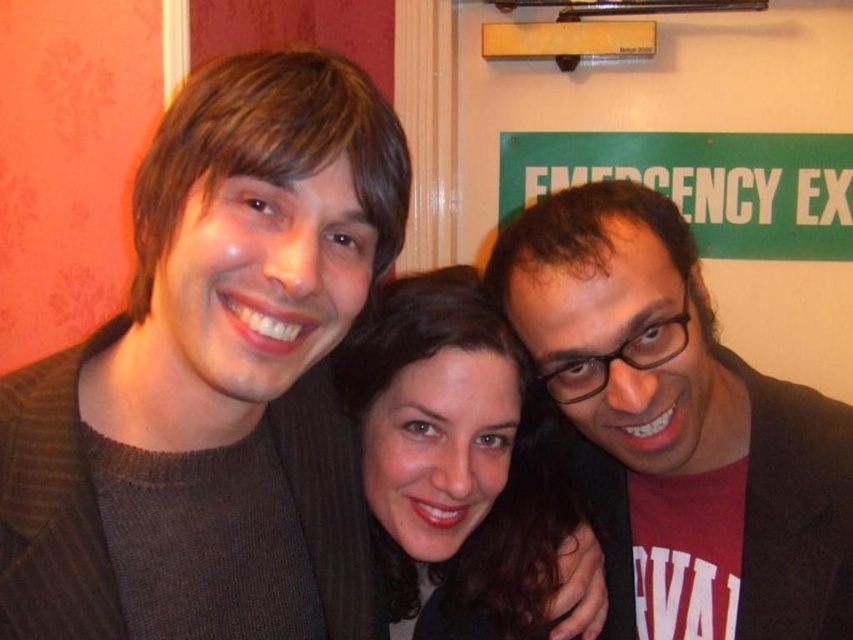
Based on the photo, you are standing in front of the photograph and want to know if the point at coordinate (80,579) is closer to you than the point at coordinate (364,474). Can you determine this based on their positions in the image?

Yes, the point at coordinate (80,579) is in front of the point at coordinate (364,474) in the image.

You are trying to identify the person wearing the brown knitted sweater at left in the photograph. Based on the description, where exactly is the sweater located in relation to the matte black hair at center?

The brown knitted sweater at left is positioned over the matte black hair at center, meaning the sweater is covering part of the hair in the image.